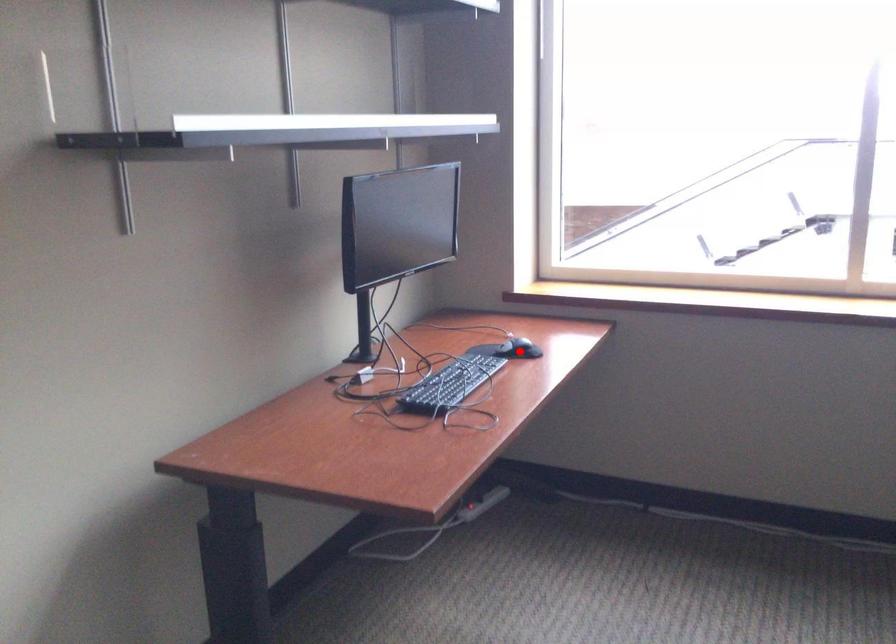
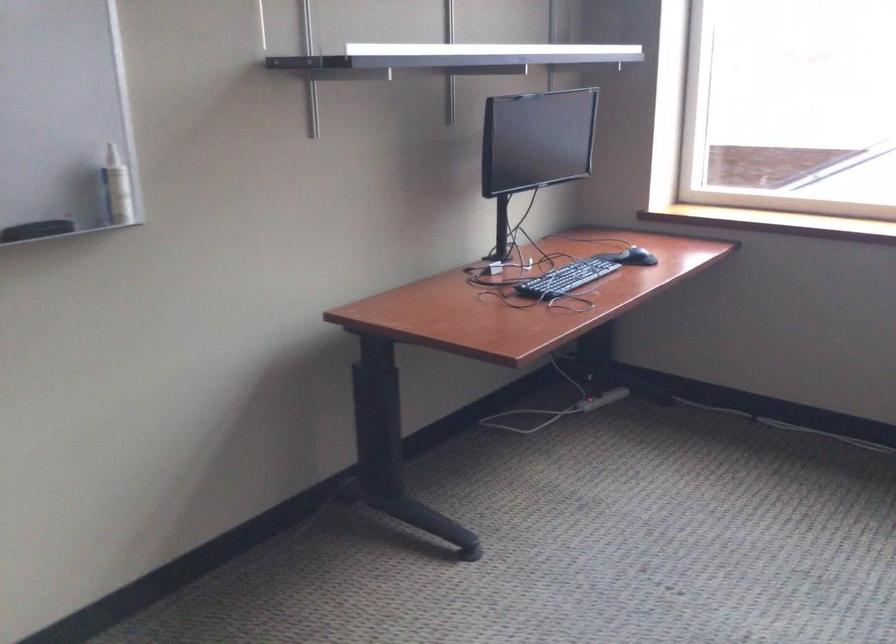
Locate, in the second image, the point that corresponds to the highlighted location in the first image.

(636, 257)